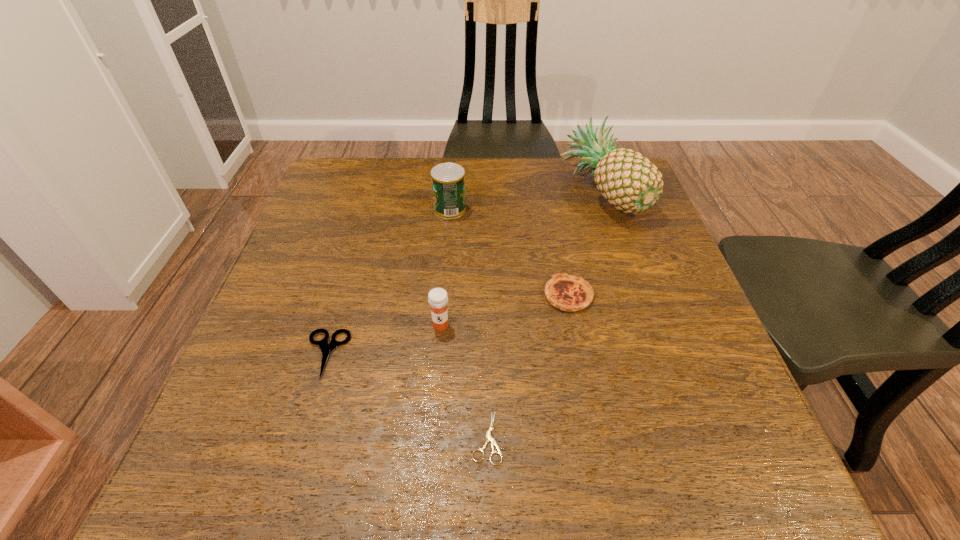
You are a GUI agent. You are given a task and a screenshot of the screen. Output one action in this format:
    pyautogui.click(x=<x>, y=<y>)
    Task: Click on the object at the far right corner
    Image resolution: width=960 pixels, height=540 pixels.
    Given the screenshot: What is the action you would take?
    pyautogui.click(x=628, y=180)

Find the location of a particular element. The height and width of the screenshot is (540, 960). free space at the far edge is located at coordinates (482, 184).

This screenshot has height=540, width=960. Identify the location of vacant space at the left edge of the desktop. (328, 271).

Where is `free space at the right edge of the desktop`? free space at the right edge of the desktop is located at coordinates (616, 265).

At what (x,y) coordinates should I click in order to perform the action: click on free spot at the far left corner of the desktop. Please return your answer as a coordinate pair (x, y). The image size is (960, 540). Looking at the image, I should click on (364, 200).

Where is `vacant area at the near left corner of the desktop`? The width and height of the screenshot is (960, 540). vacant area at the near left corner of the desktop is located at coordinates (198, 454).

At what (x,y) coordinates should I click in order to perform the action: click on blank region between the second shortest object and the third object from right to left. Please return your answer as a coordinate pair (x, y). Looking at the image, I should click on (406, 396).

This screenshot has height=540, width=960. I want to click on empty location between the tallest object and the third object from right to left, so click(x=543, y=315).

You are a GUI agent. You are given a task and a screenshot of the screen. Output one action in this format:
    pyautogui.click(x=<x>, y=<y>)
    Task: Click on the vacant space that's between the third farthest object and the third tallest object
    This screenshot has width=960, height=540.
    Given the screenshot: What is the action you would take?
    pyautogui.click(x=505, y=310)

The width and height of the screenshot is (960, 540). What are the coordinates of `vacant space that's between the tallest object and the third farthest object` in the screenshot? It's located at (585, 244).